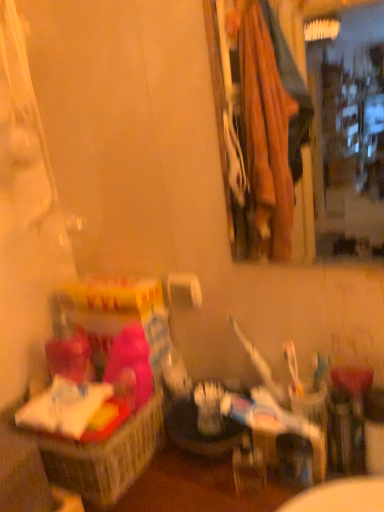
Question: From a real-world perspective, is white matte toilet paper at center positioned over pink fabric basket at left based on gravity?

Choices:
 (A) no
 (B) yes

Answer: (B)

Question: Is pink fabric basket at left located within white matte toilet paper at center?

Choices:
 (A) no
 (B) yes

Answer: (A)

Question: Is white matte toilet paper at center at the left side of pink fabric basket at left?

Choices:
 (A) yes
 (B) no

Answer: (B)

Question: Considering the relative sizes of white matte toilet paper at center and pink fabric basket at left in the image provided, is white matte toilet paper at center wider than pink fabric basket at left?

Choices:
 (A) yes
 (B) no

Answer: (B)

Question: Is white matte toilet paper at center thinner than pink fabric basket at left?

Choices:
 (A) no
 (B) yes

Answer: (B)

Question: From the image's perspective, is white matte toilet paper at center on pink fabric basket at left?

Choices:
 (A) no
 (B) yes

Answer: (B)

Question: Is white matte toilet paper at center far from wooden frame mirror at upper right?

Choices:
 (A) no
 (B) yes

Answer: (B)

Question: From a real-world perspective, is white matte toilet paper at center located beneath wooden frame mirror at upper right?

Choices:
 (A) yes
 (B) no

Answer: (A)

Question: Considering the relative sizes of white matte toilet paper at center and wooden frame mirror at upper right in the image provided, is white matte toilet paper at center wider than wooden frame mirror at upper right?

Choices:
 (A) no
 (B) yes

Answer: (A)

Question: From a real-world perspective, is white matte toilet paper at center located higher than wooden frame mirror at upper right?

Choices:
 (A) yes
 (B) no

Answer: (B)

Question: From the image's perspective, is white matte toilet paper at center under wooden frame mirror at upper right?

Choices:
 (A) no
 (B) yes

Answer: (B)

Question: Does white matte toilet paper at center have a smaller size compared to wooden frame mirror at upper right?

Choices:
 (A) yes
 (B) no

Answer: (A)

Question: Can you confirm if wooden frame mirror at upper right is wider than pink fabric basket at left?

Choices:
 (A) no
 (B) yes

Answer: (A)